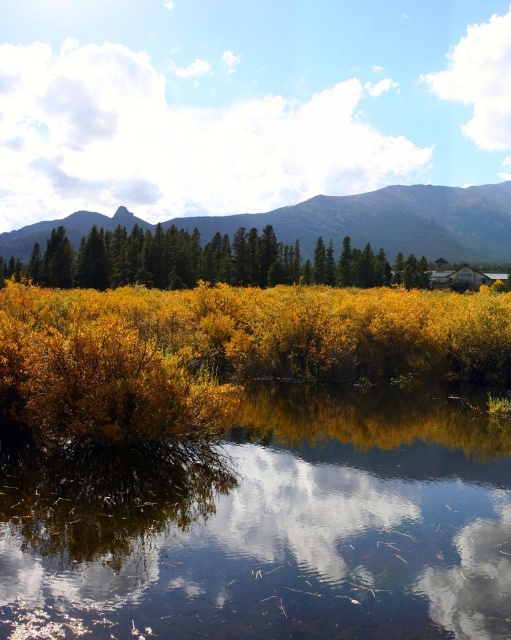
You are an outdoor photographer planning to capture the glossy reflective water at center and the rocky mountain at upper center in a single shot. Based on their positions, which object should you focus on first to ensure both are in frame?

The glossy reflective water at center is positioned on the left side of rocky mountain at upper center, so you should focus on the glossy reflective water at center first to ensure both are in frame.

Based on the photo, you are standing at the point marked as point [205,260] in the image. What do you see directly in front of you?

At point [205,260] lies green matte trees at center, so you would see green matte trees at center directly in front of you.